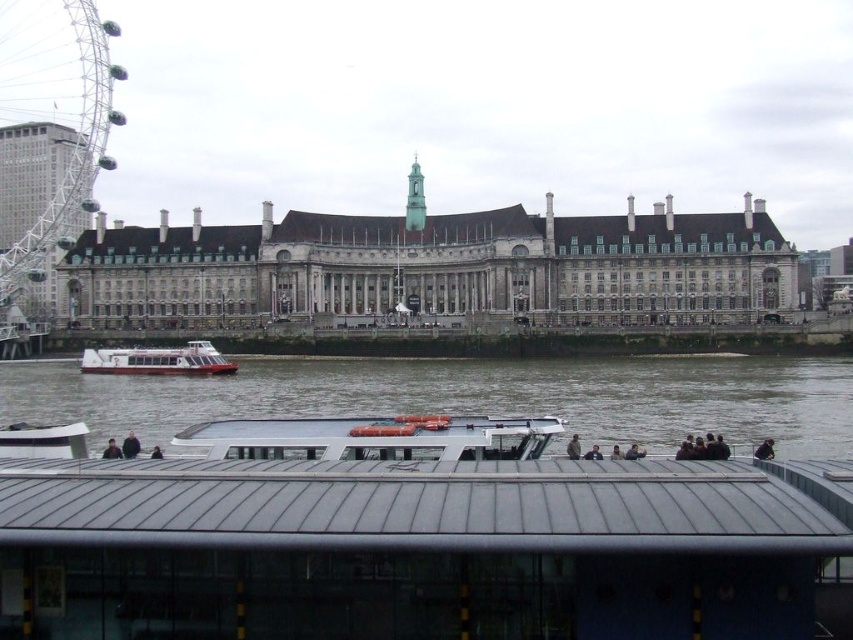
Does gray stone building at center appear over brown water at lower center?

Yes.

Is gray stone building at center further to camera compared to brown water at lower center?

That is True.

Does point (466, 278) lie behind point (149, 440)?

Yes, it is.

Where is `gray stone building at center`? Image resolution: width=853 pixels, height=640 pixels. gray stone building at center is located at coordinates (433, 268).

Is brown water at lower center in front of metallic ferris wheel at left?

Yes.

Looking at this image, is brown water at lower center taller than metallic ferris wheel at left?

In fact, brown water at lower center may be shorter than metallic ferris wheel at left.

Identify the location of brown water at lower center. This screenshot has width=853, height=640. (468, 396).

Which is more to the left, metallic ferris wheel at left or white glossy boat at center?

Positioned to the left is metallic ferris wheel at left.

Between metallic ferris wheel at left and white glossy boat at center, which one has less height?

Standing shorter between the two is white glossy boat at center.

Describe the element at coordinates (54, 115) in the screenshot. This screenshot has height=640, width=853. I see `metallic ferris wheel at left` at that location.

Where is `metallic ferris wheel at left`? This screenshot has width=853, height=640. metallic ferris wheel at left is located at coordinates (54, 115).